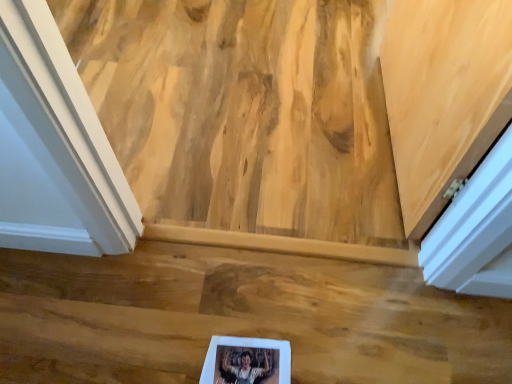
Image resolution: width=512 pixels, height=384 pixels. What do you see at coordinates (247, 361) in the screenshot? I see `white matte picture frame at lower center` at bounding box center [247, 361].

Find the location of a particular element. This screenshot has width=512, height=384. white matte picture frame at lower center is located at coordinates (247, 361).

Where is `wooden floor at center`? The width and height of the screenshot is (512, 384). wooden floor at center is located at coordinates (239, 318).

Describe the element at coordinates (239, 318) in the screenshot. I see `wooden floor at center` at that location.

Where is `white matte picture frame at lower center`? white matte picture frame at lower center is located at coordinates (247, 361).

Is wooden floor at center to the right of white matte picture frame at lower center from the viewer's perspective?

Yes, wooden floor at center is to the right of white matte picture frame at lower center.

Is wooden floor at center closer to camera compared to white matte picture frame at lower center?

No, wooden floor at center is further to the viewer.

Between point (111, 293) and point (286, 360), which one is positioned behind?

The point (111, 293) is farther from the camera.

From the image's perspective, is wooden floor at center above or below white matte picture frame at lower center?

From the image's perspective, wooden floor at center appears above white matte picture frame at lower center.

From a real-world perspective, is wooden floor at center positioned under white matte picture frame at lower center based on gravity?

Actually, wooden floor at center is physically above white matte picture frame at lower center in the real world.

Can you confirm if wooden floor at center is wider than white matte picture frame at lower center?

Indeed, wooden floor at center has a greater width compared to white matte picture frame at lower center.

Is wooden floor at center taller or shorter than white matte picture frame at lower center?

Clearly, wooden floor at center is taller compared to white matte picture frame at lower center.

Considering the sizes of objects wooden floor at center and white matte picture frame at lower center in the image provided, who is bigger, wooden floor at center or white matte picture frame at lower center?

wooden floor at center is bigger.

Does wooden floor at center contain white matte picture frame at lower center?

Yes, wooden floor at center is surrounding white matte picture frame at lower center.

Based on the photo, would you consider wooden floor at center to be distant from white matte picture frame at lower center?

That's not correct — wooden floor at center is a little close to white matte picture frame at lower center.

Is wooden floor at center oriented towards white matte picture frame at lower center?

Yes, wooden floor at center faces towards white matte picture frame at lower center.

Image resolution: width=512 pixels, height=384 pixels. I want to click on stairwell on the right of white matte picture frame at lower center, so click(239, 318).

Can you confirm if white matte picture frame at lower center is positioned to the left of wooden floor at center?

Correct, you'll find white matte picture frame at lower center to the left of wooden floor at center.

Considering their positions, is white matte picture frame at lower center located in front of or behind wooden floor at center?

In the image, white matte picture frame at lower center appears in front of wooden floor at center.

Considering the positions of point (248, 373) and point (244, 308), is point (248, 373) closer or farther from the camera than point (244, 308)?

Point (248, 373).

Looking at this image, from the image's perspective, is white matte picture frame at lower center on top of wooden floor at center?

No, from the image's perspective, white matte picture frame at lower center is not above wooden floor at center.

From a real-world perspective, is white matte picture frame at lower center on wooden floor at center?

Actually, white matte picture frame at lower center is physically below wooden floor at center in the real world.

Can you confirm if white matte picture frame at lower center is wider than wooden floor at center?

In fact, white matte picture frame at lower center might be narrower than wooden floor at center.

From their relative heights in the image, would you say white matte picture frame at lower center is taller or shorter than wooden floor at center?

Clearly, white matte picture frame at lower center is shorter compared to wooden floor at center.

Looking at the image, does white matte picture frame at lower center seem bigger or smaller compared to wooden floor at center?

Clearly, white matte picture frame at lower center is smaller in size than wooden floor at center.

Is wooden floor at center completely or partially inside white matte picture frame at lower center?

Definitely not — wooden floor at center is not inside white matte picture frame at lower center.

Is white matte picture frame at lower center with wooden floor at center?

white matte picture frame at lower center and wooden floor at center are not in contact.

Based on the photo, is white matte picture frame at lower center oriented away from wooden floor at center?

Yes, white matte picture frame at lower center is positioned with its back facing wooden floor at center.

The image size is (512, 384). I want to click on stairwell above the white matte picture frame at lower center (from a real-world perspective), so click(x=239, y=318).

The image size is (512, 384). In order to click on picture frame below the wooden floor at center (from the image's perspective) in this screenshot , I will do `click(247, 361)`.

Locate an element on the screen. This screenshot has width=512, height=384. stairwell above the white matte picture frame at lower center (from a real-world perspective) is located at coordinates (239, 318).